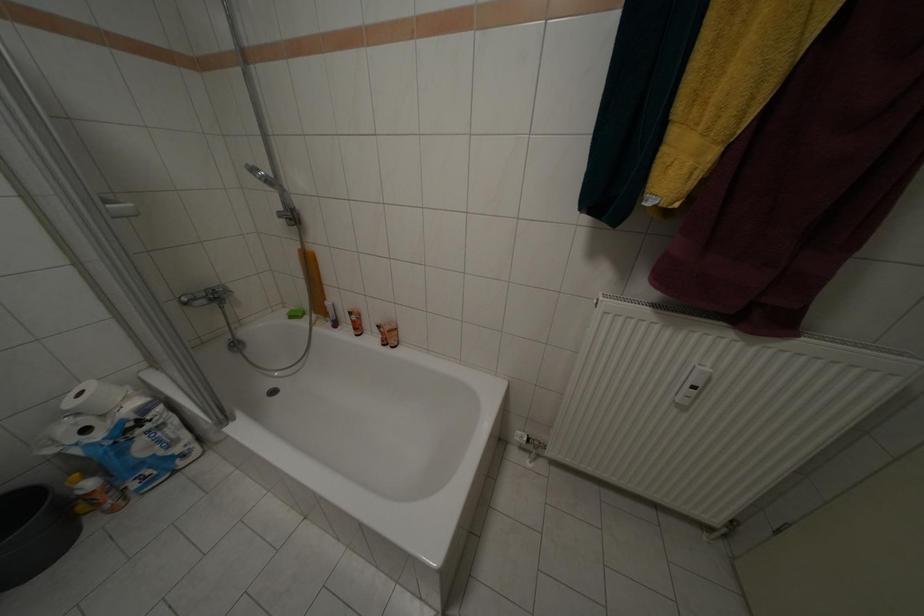
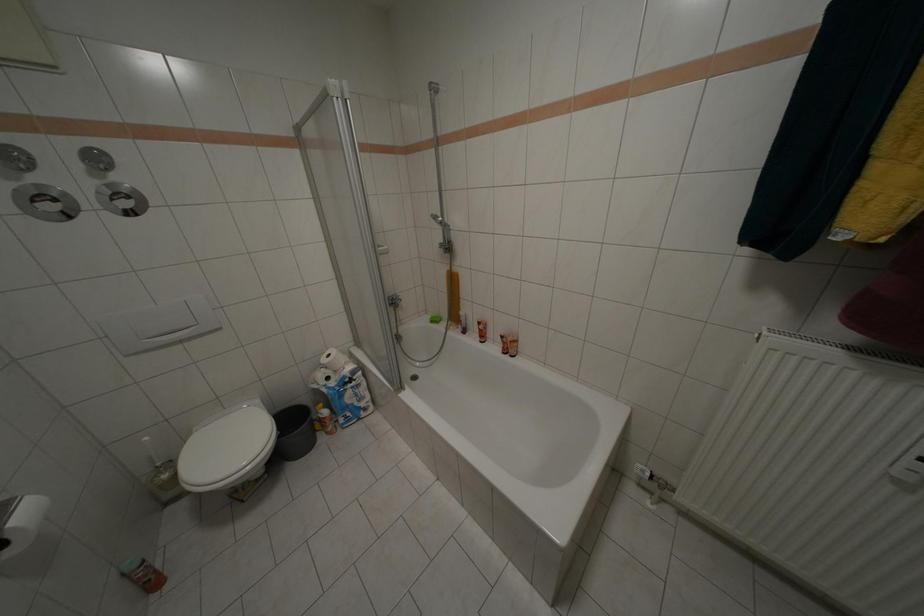
Question: The camera is either moving clockwise (left) or counter-clockwise (right) around the object. The first image is from the beginning of the video and the second image is from the end. Is the camera moving left or right when shooting the video?

Choices:
 (A) Left
 (B) Right

Answer: (B)